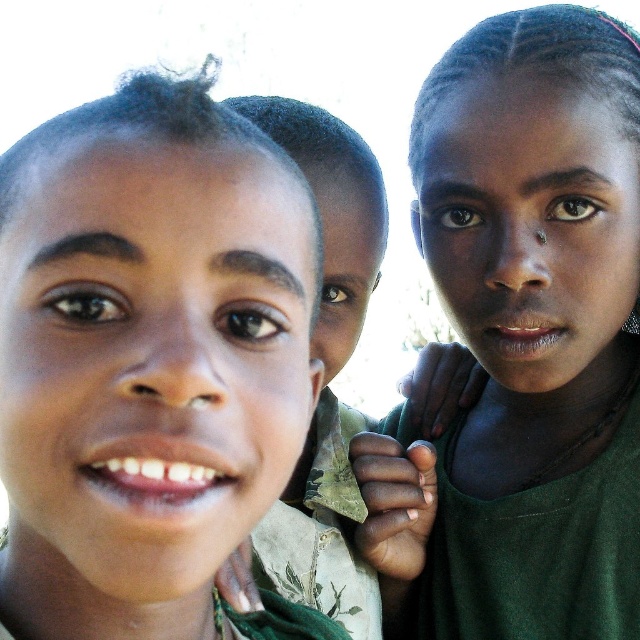
You are a photographer trying to capture a clear shot of the matte green shirt at left and the dark green fabric at upper right. Which object is located lower in the image?

The matte green shirt at left is positioned under the dark green fabric at upper right, meaning it is lower in the image.

You are trying to decide which clothing item to choose for a hiking trip. You have the dark green fabric at upper right and the camouflage fabric shirt at center. Based on their sizes in the image, which one would you pick if you prefer a wider garment?

The dark green fabric at upper right is wider than the camouflage fabric shirt at center, so you should choose the dark green fabric at upper right for a wider garment.

You are a photographer trying to adjust the focus of your camera to capture the matte green shirt at left. What are the coordinates where you should focus?

The coordinates to focus on are (148, 364).